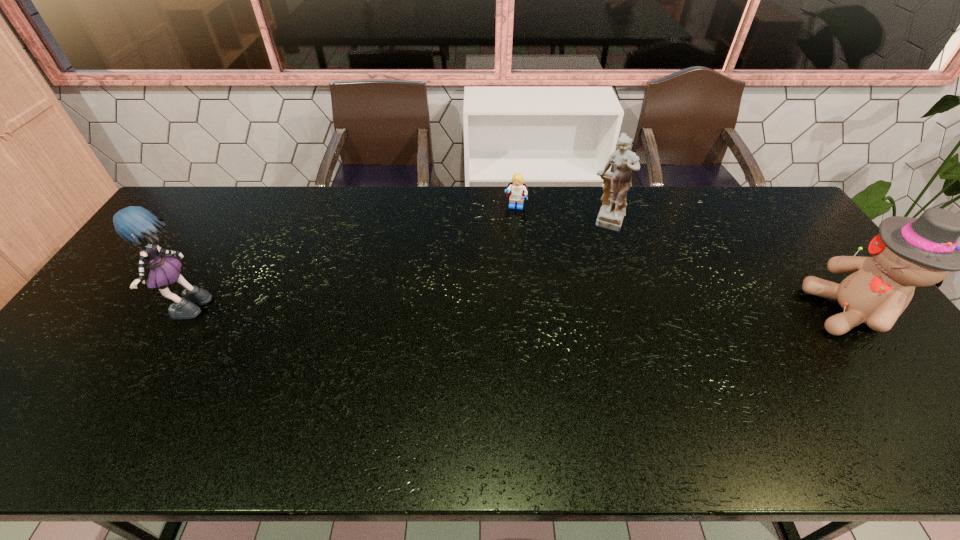
Locate an element on the screen. The height and width of the screenshot is (540, 960). vacant region between the rightmost object and the left rag_doll is located at coordinates (519, 312).

The width and height of the screenshot is (960, 540). What are the coordinates of `unoccupied position between the Lego and the third object from left to right` in the screenshot? It's located at (562, 215).

Where is `empty space that is in between the left rag_doll and the Lego`? empty space that is in between the left rag_doll and the Lego is located at coordinates (352, 259).

What are the coordinates of `vacant area between the figurine and the leftmost object` in the screenshot? It's located at (398, 267).

The height and width of the screenshot is (540, 960). I want to click on free point between the shortest object and the leftmost object, so click(352, 259).

This screenshot has width=960, height=540. Find the location of `free space between the shortest object and the leftmost object`. free space between the shortest object and the leftmost object is located at coordinates (352, 259).

Choose which object is the nearest neighbor to the third object from right to left. Please provide its 2D coordinates. Your answer should be formatted as a tuple, i.e. [(x, y)], where the tuple contains the x and y coordinates of a point satisfying the conditions above.

[(616, 185)]

Locate which object is the second closest to the figurine. Please provide its 2D coordinates. Your answer should be formatted as a tuple, i.e. [(x, y)], where the tuple contains the x and y coordinates of a point satisfying the conditions above.

[(908, 252)]

You are a GUI agent. You are given a task and a screenshot of the screen. Output one action in this format:
    pyautogui.click(x=<x>, y=<y>)
    Task: Click on the free space that satisfies the following two spatial constraints: 1. on the front side of the right rag_doll; 2. on the front-facing side of the third object from left to right
    The image size is (960, 540).
    Given the screenshot: What is the action you would take?
    pyautogui.click(x=636, y=312)

The width and height of the screenshot is (960, 540). Identify the location of free spot that satisfies the following two spatial constraints: 1. on the front side of the second object from left to right; 2. on the front-facing side of the rightmost object. (525, 312).